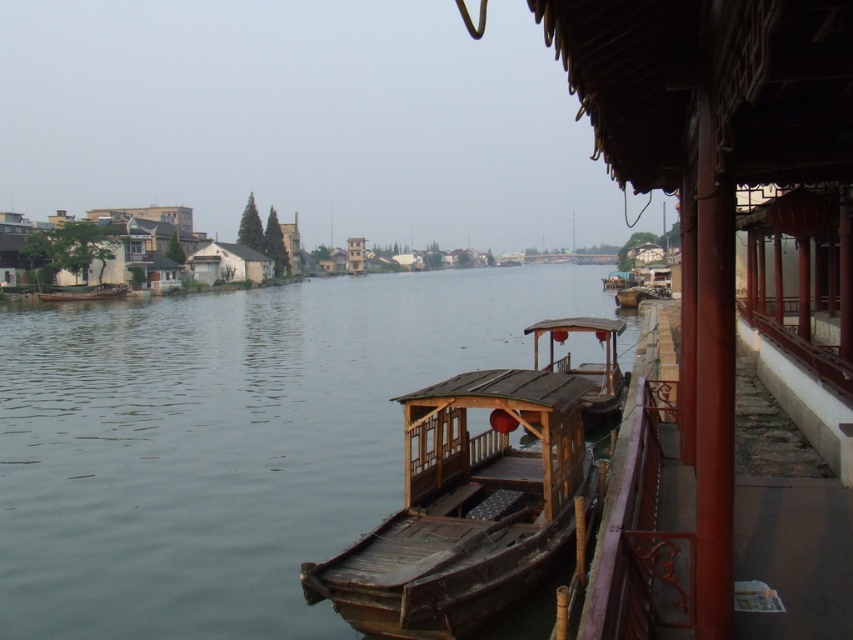
You are standing on the riverside and want to reach a specific point marked at coordinates point (158, 538). Given that you can only walk along the wooden walkway supported by red pillars on the right side, how far will you have to walk to reach that point?

The distance of point (158, 538) from viewer is 16.46 meters, so you will have to walk 16.46 meters along the wooden walkway supported by red pillars on the right side to reach that point.